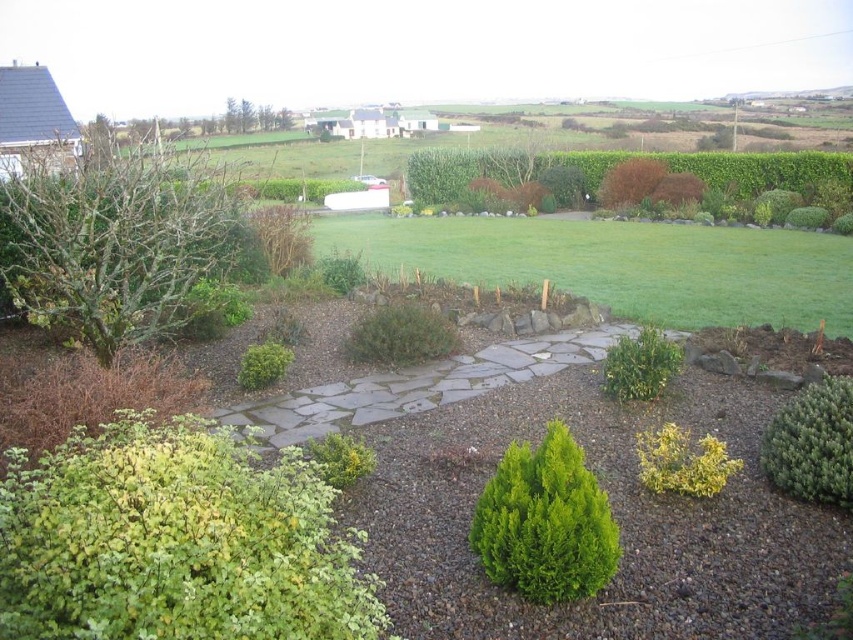
You are a gardener who needs to water both the green leafy shrub at lower left and the gray stone path at center. Since the watering can has a 10 feet range, can you reach both from your current position without moving?

The green leafy shrub at lower left and the gray stone path at center are 9.13 feet apart from each other. Since the watering can has a 10 feet range, you can reach both from your current position without moving.

Consider the image. You are standing at the center of the garden and want to locate the green leafy shrub at lower left. According to the coordinates provided, where should you look relative to your current position?

The green leafy shrub at lower left is located at coordinates point [177,540], which means it is positioned to the left and slightly below your current position in the garden.